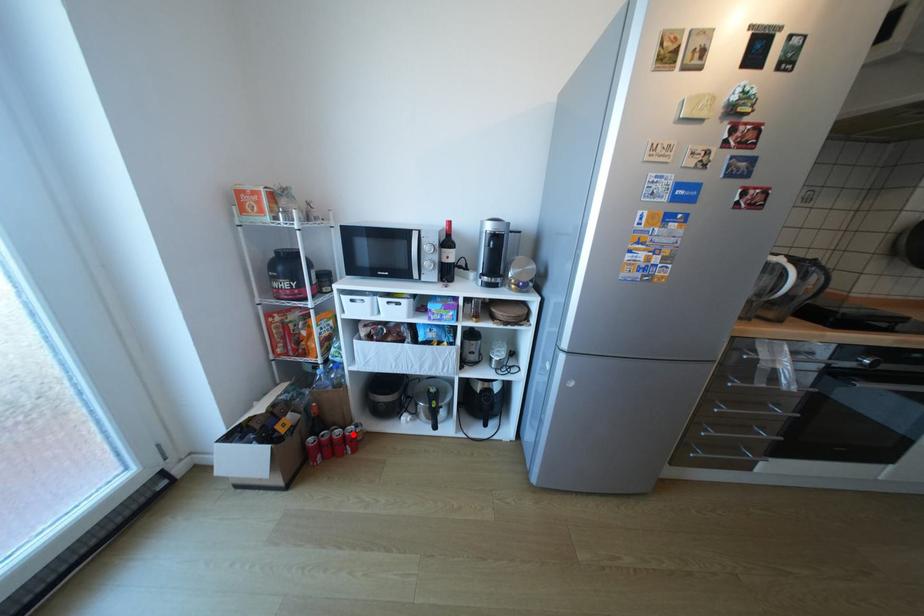
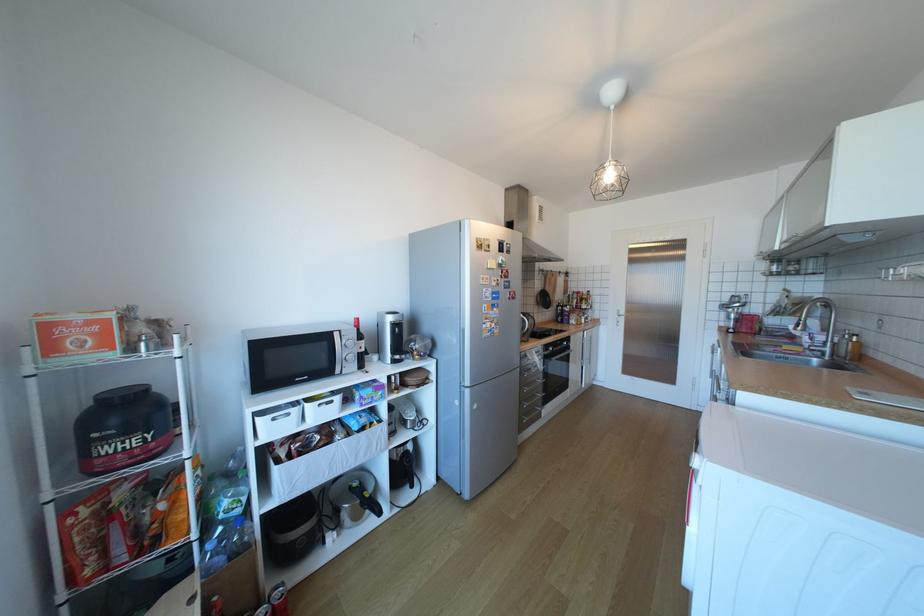
Locate, in the second image, the point that corresponds to the highlighted location in the first image.

(283, 607)